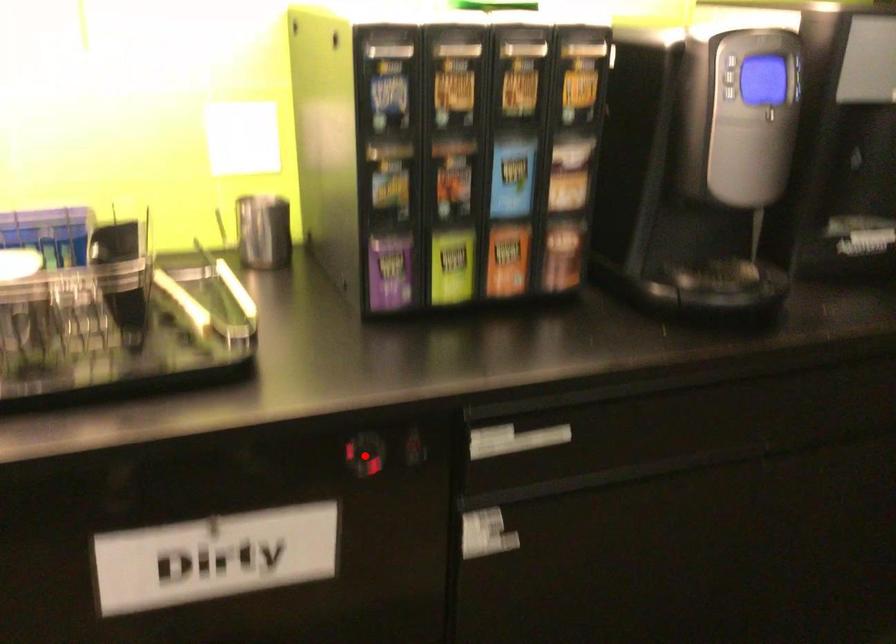
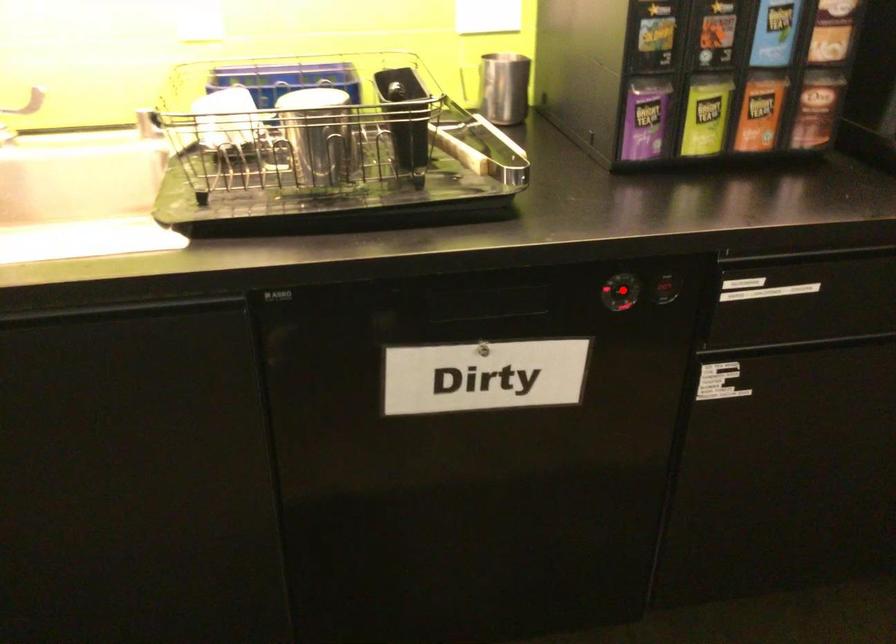
I am providing you with two images of the same scene from different viewpoints. A red point is marked on the first image and another point is marked on the second image. Does the point marked in image1 correspond to the same location as the one in image2?

Yes